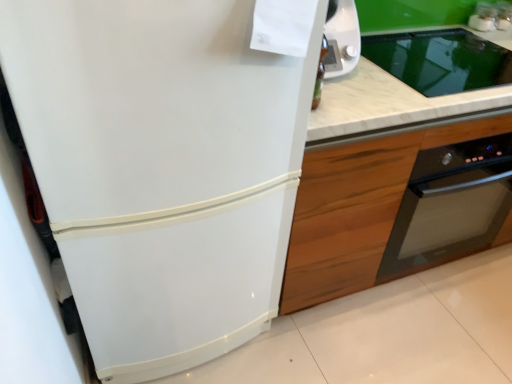
Question: From the image's perspective, is wooden cabinet at right on white glossy refrigerator at left?

Choices:
 (A) yes
 (B) no

Answer: (A)

Question: Is white glossy refrigerator at left located within wooden cabinet at right?

Choices:
 (A) yes
 (B) no

Answer: (B)

Question: From a real-world perspective, is wooden cabinet at right physically below white glossy refrigerator at left?

Choices:
 (A) no
 (B) yes

Answer: (B)

Question: Is wooden cabinet at right smaller than white glossy refrigerator at left?

Choices:
 (A) yes
 (B) no

Answer: (A)

Question: Is wooden cabinet at right to the right of white glossy refrigerator at left from the viewer's perspective?

Choices:
 (A) no
 (B) yes

Answer: (B)

Question: Does wooden cabinet at right appear on the left side of white glossy refrigerator at left?

Choices:
 (A) yes
 (B) no

Answer: (B)

Question: From the image's perspective, does white marble countertop at center appear higher than white glossy refrigerator at left?

Choices:
 (A) yes
 (B) no

Answer: (A)

Question: Can you confirm if white marble countertop at center is taller than white glossy refrigerator at left?

Choices:
 (A) no
 (B) yes

Answer: (A)

Question: Does white marble countertop at center lie in front of white glossy refrigerator at left?

Choices:
 (A) no
 (B) yes

Answer: (A)

Question: Is white glossy refrigerator at left surrounded by white marble countertop at center?

Choices:
 (A) yes
 (B) no

Answer: (B)

Question: Is white marble countertop at center behind white glossy refrigerator at left?

Choices:
 (A) no
 (B) yes

Answer: (B)

Question: Considering the relative sizes of white marble countertop at center and white glossy refrigerator at left in the image provided, is white marble countertop at center shorter than white glossy refrigerator at left?

Choices:
 (A) yes
 (B) no

Answer: (A)

Question: Is the depth of white glossy refrigerator at left greater than that of wooden cabinet at right?

Choices:
 (A) yes
 (B) no

Answer: (B)